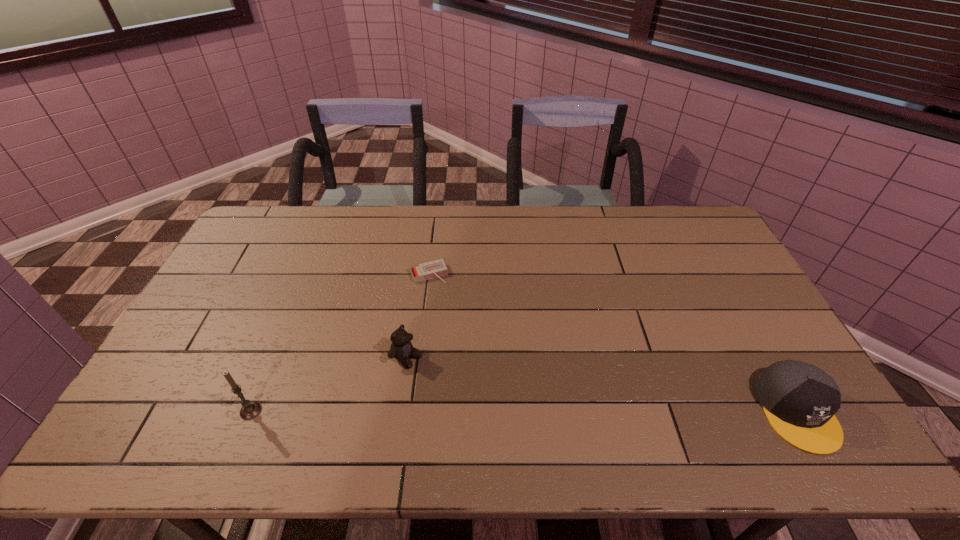
The height and width of the screenshot is (540, 960). Find the location of `free spot on the desktop that is between the leftmost object and the rightmost object and is positioned on the face of the second farthest object`. free spot on the desktop that is between the leftmost object and the rightmost object and is positioned on the face of the second farthest object is located at coordinates (495, 411).

Identify the location of vacant space on the desktop that is between the tallest object and the cap and is positioned on the striking surface of the farthest object. (487, 411).